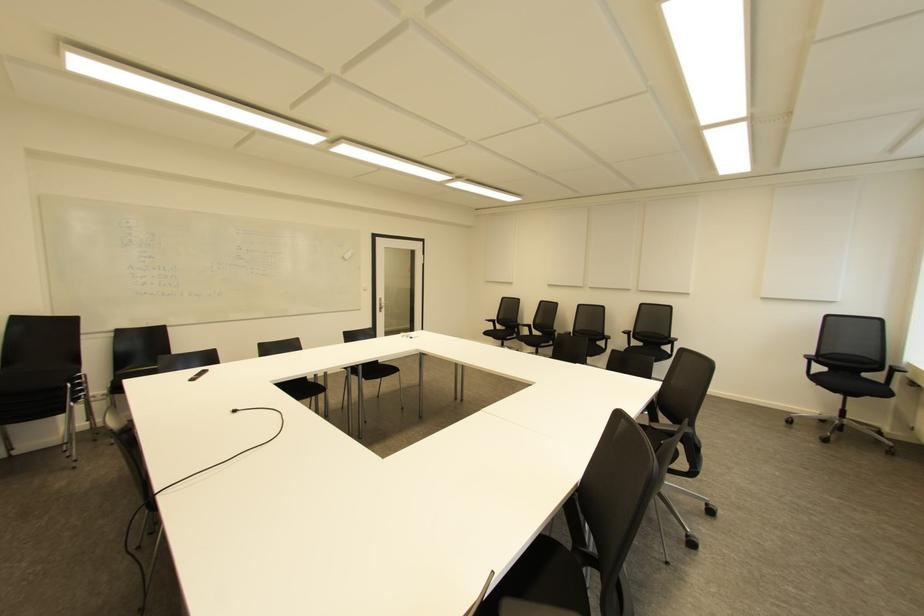
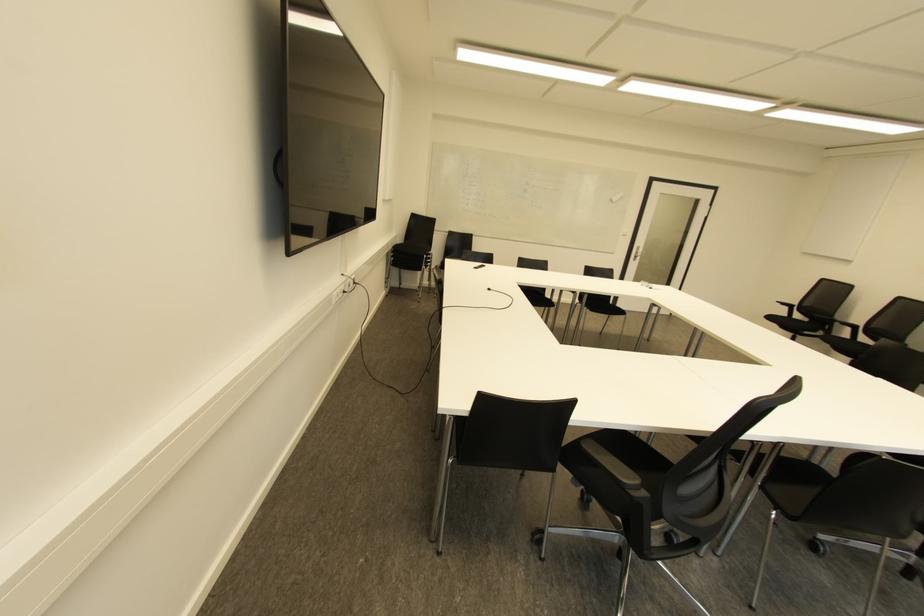
Find the pixel in the second image that matches pixel 491 322 in the first image.

(785, 307)